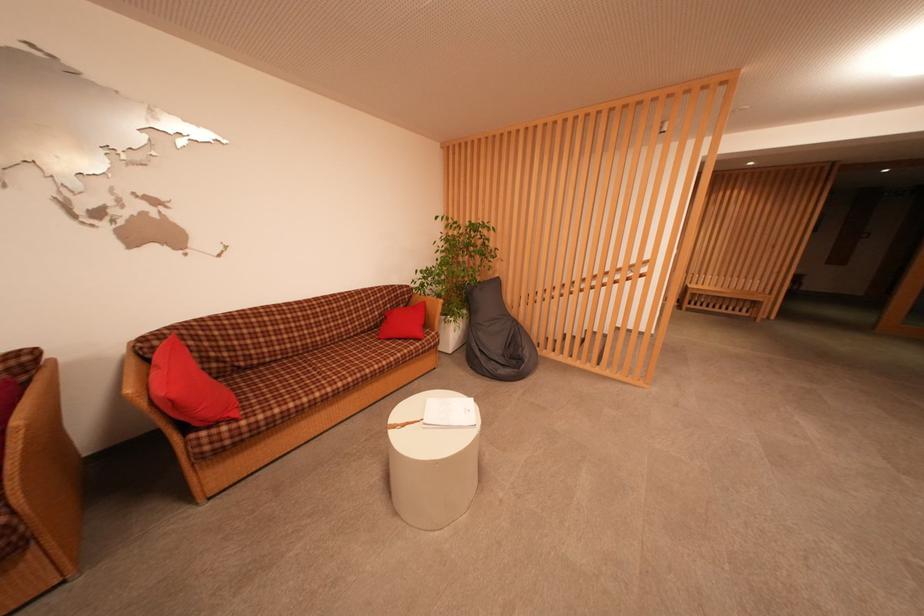
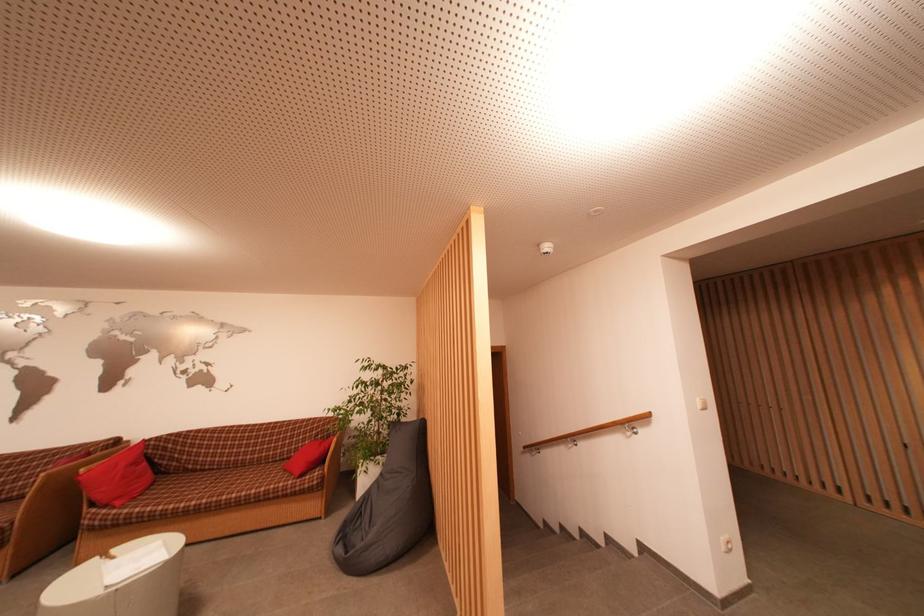
Where in the second image is the point corresponding to (254,371) from the first image?

(198, 474)